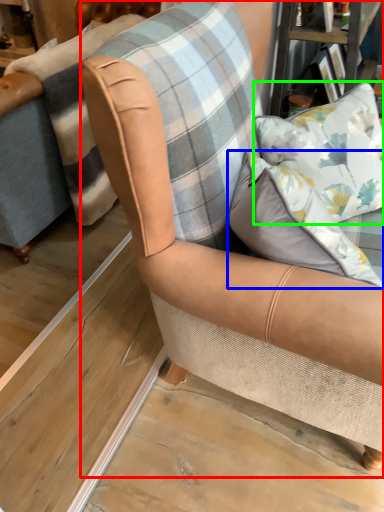
Question: Estimate the real-world distances between objects in this image. Which object is farther from chair (highlighted by a red box), pillow (highlighted by a blue box) or pillow (highlighted by a green box)?

Choices:
 (A) pillow
 (B) pillow

Answer: (B)